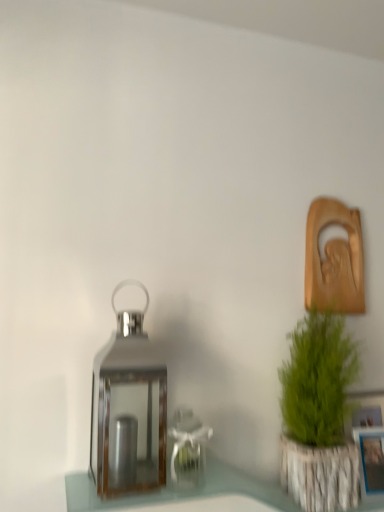
Question: Is shiny metallic lantern at center facing towards blue plastic picture frame at lower right?

Choices:
 (A) yes
 (B) no

Answer: (B)

Question: Does shiny metallic lantern at center have a smaller size compared to blue plastic picture frame at lower right?

Choices:
 (A) yes
 (B) no

Answer: (B)

Question: Can blue plastic picture frame at lower right be found inside shiny metallic lantern at center?

Choices:
 (A) no
 (B) yes

Answer: (A)

Question: Is shiny metallic lantern at center thinner than blue plastic picture frame at lower right?

Choices:
 (A) yes
 (B) no

Answer: (B)

Question: Would you say shiny metallic lantern at center is outside blue plastic picture frame at lower right?

Choices:
 (A) no
 (B) yes

Answer: (B)

Question: Can you confirm if shiny metallic lantern at center is shorter than blue plastic picture frame at lower right?

Choices:
 (A) yes
 (B) no

Answer: (B)

Question: Can you confirm if blue plastic picture frame at lower right is positioned to the left of green textured plant at right?

Choices:
 (A) yes
 (B) no

Answer: (B)

Question: Does blue plastic picture frame at lower right contain green textured plant at right?

Choices:
 (A) no
 (B) yes

Answer: (A)

Question: Is blue plastic picture frame at lower right next to green textured plant at right?

Choices:
 (A) yes
 (B) no

Answer: (B)

Question: Is blue plastic picture frame at lower right outside of green textured plant at right?

Choices:
 (A) no
 (B) yes

Answer: (B)

Question: Does blue plastic picture frame at lower right have a lesser width compared to green textured plant at right?

Choices:
 (A) no
 (B) yes

Answer: (B)

Question: Is blue plastic picture frame at lower right shorter than green textured plant at right?

Choices:
 (A) yes
 (B) no

Answer: (A)

Question: Can you confirm if blue plastic picture frame at lower right is smaller than shiny metallic lantern at center?

Choices:
 (A) no
 (B) yes

Answer: (B)